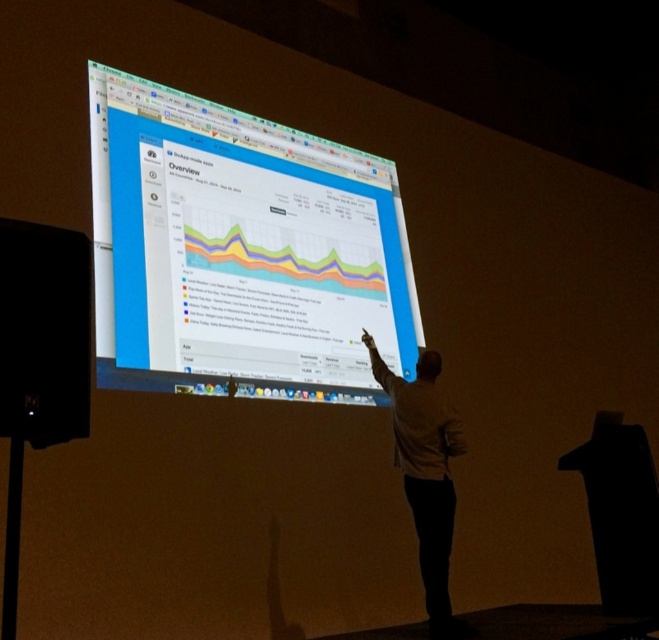
Question: Is black matte speaker at lower left wider than white matte shirt at center?

Choices:
 (A) yes
 (B) no

Answer: (B)

Question: Which of the following is the farthest from the observer?

Choices:
 (A) white matte shirt at center
 (B) matte black monitor at center

Answer: (B)

Question: Which object is farther from the camera taking this photo?

Choices:
 (A) black matte speaker at lower left
 (B) white matte shirt at center
 (C) matte black monitor at center

Answer: (C)

Question: Can you confirm if matte black monitor at center is positioned above black matte speaker at lower left?

Choices:
 (A) no
 (B) yes

Answer: (B)

Question: Which point is closer to the camera taking this photo?

Choices:
 (A) (212, 349)
 (B) (65, 292)

Answer: (B)

Question: Observing the image, what is the correct spatial positioning of matte black monitor at center in reference to white matte shirt at center?

Choices:
 (A) above
 (B) below

Answer: (A)